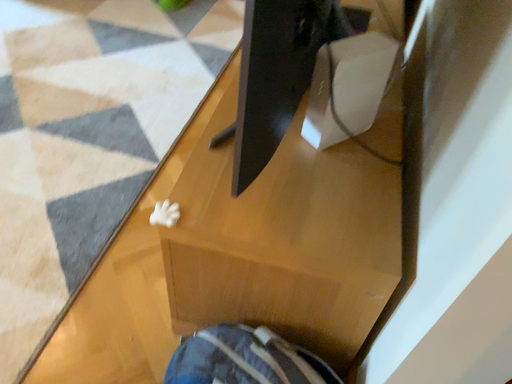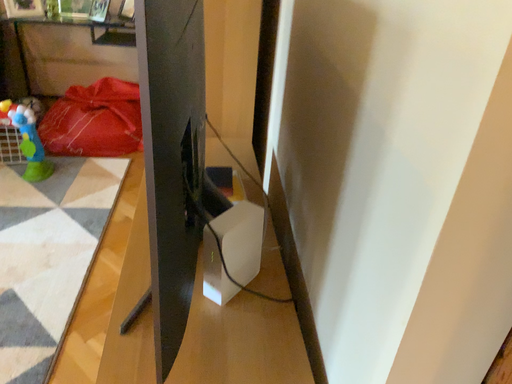
Question: Which way did the camera rotate in the video?

Choices:
 (A) rotated right
 (B) rotated left

Answer: (A)